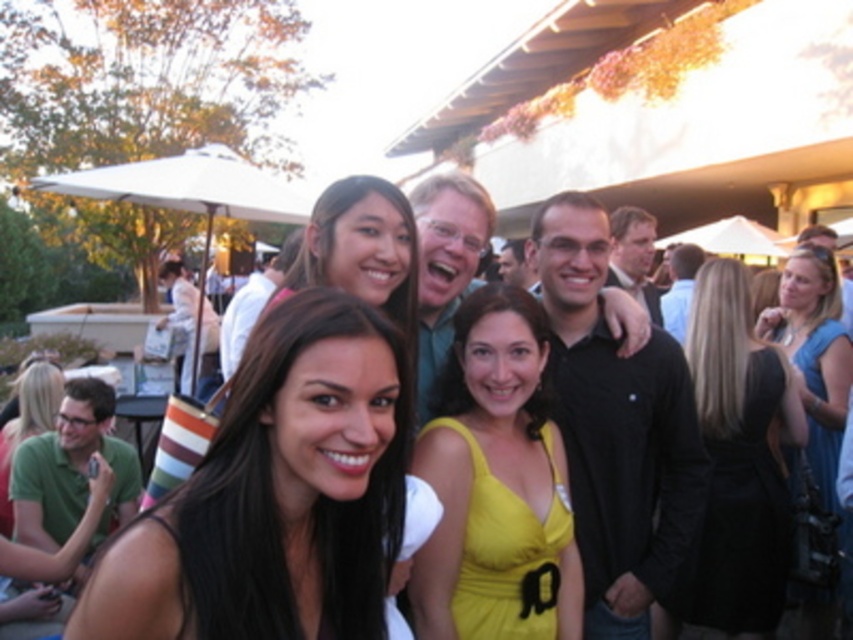
You are a photographer trying to adjust the camera focus. The black matte shirt at center and the matte green dress at lower left are in the frame. Which one should you focus on first if you want to ensure the taller object is sharp?

The black matte shirt at center should be focused on first because it has a greater height compared to the matte green dress at lower left.

You are standing in the crowd at this event and want to take a photo of both the smooth black dress at center and the black satin dress at center. Which dress should you focus on first to ensure both are in the frame?

You should focus on the smooth black dress at center first since it is closer to you than the black satin dress at center, ensuring both are in the frame by adjusting the camera angle accordingly.